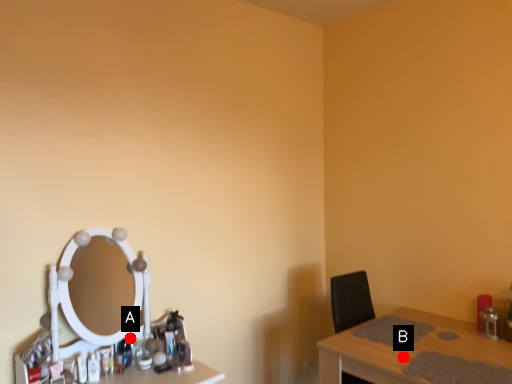
Question: Two points are circled on the image, labeled by A and B beside each circle. Which of the following is the closest to the observer?

Choices:
 (A) A is closer
 (B) B is closer

Answer: (B)